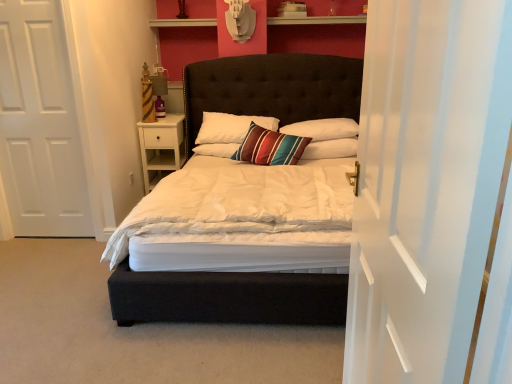
Where is `white soft pillow at center, which is counted as the third pillow, starting from the left`? This screenshot has height=384, width=512. white soft pillow at center, which is counted as the third pillow, starting from the left is located at coordinates (331, 149).

Locate an element on the screen. Image resolution: width=512 pixels, height=384 pixels. striped fabric pillow at center, which is the 3th pillow in right-to-left order is located at coordinates (270, 147).

Find the location of a particular element. white matte door at left is located at coordinates (40, 124).

Describe the element at coordinates (40, 124) in the screenshot. The width and height of the screenshot is (512, 384). I see `white matte door at left` at that location.

The height and width of the screenshot is (384, 512). In order to click on white soft pillow at center, acting as the 1th pillow starting from the right in this screenshot , I will do `click(331, 149)`.

Is white sheer curtain at right at the back of striped fabric pillow at center, the 2th pillow from the left?

No, white sheer curtain at right is not at the back of striped fabric pillow at center, the 2th pillow from the left.

Is striped fabric pillow at center, the 2th pillow from the left, positioned beyond the bounds of white sheer curtain at right?

Indeed, striped fabric pillow at center, the 2th pillow from the left, is completely outside white sheer curtain at right.

Which of these two, striped fabric pillow at center, the 2th pillow from the left, or white sheer curtain at right, is wider?

striped fabric pillow at center, the 2th pillow from the left, is wider.

Image resolution: width=512 pixels, height=384 pixels. What are the coordinates of `the 3rd pillow above when counting from the white sheer curtain at right (from the image's perspective)` in the screenshot? It's located at (323, 129).

In terms of width, does white soft pillow at center, which is counted as the third pillow, starting from the left, look wider or thinner when compared to white matte door at left?

white soft pillow at center, which is counted as the third pillow, starting from the left, is wider than white matte door at left.

Is white soft pillow at center, which is counted as the third pillow, starting from the left, outside of white matte door at left?

white soft pillow at center, which is counted as the third pillow, starting from the left, lies outside white matte door at left's area.

Is white soft pillow at center, acting as the 1th pillow starting from the right, shorter than white matte door at left?

Yes, white soft pillow at center, acting as the 1th pillow starting from the right, is shorter than white matte door at left.

Considering the relative sizes of white soft pillow at center, acting as the 1th pillow starting from the right, and white matte door at left in the image provided, is white soft pillow at center, acting as the 1th pillow starting from the right, bigger than white matte door at left?

Actually, white soft pillow at center, acting as the 1th pillow starting from the right, might be smaller than white matte door at left.

Which is closer to the camera, (256,124) or (1,134)?

Point (256,124).

Is white matte door at left surrounded by striped fabric pillow at center, which is the 3th pillow in right-to-left order?

That's incorrect, white matte door at left is not inside striped fabric pillow at center, which is the 3th pillow in right-to-left order.

From the image's perspective, which one is positioned lower, striped fabric pillow at center, the 1th pillow when ordered from left to right, or white matte door at left?

white matte door at left is shown below in the image.

Is white matte door at left at the back of striped fabric pillow at center, the 1th pillow when ordered from left to right?

No, white matte door at left is not at the back of striped fabric pillow at center, the 1th pillow when ordered from left to right.

Can you confirm if striped fabric pillow at center, the 1th pillow when ordered from left to right, is positioned to the right of striped fabric pillow at center, which is the 2th pillow in right-to-left order?

No.

I want to click on pillow on the left side of striped fabric pillow at center, the 2th pillow from the left, so click(270, 147).

How many degrees apart are the facing directions of striped fabric pillow at center, which is the 3th pillow in right-to-left order, and striped fabric pillow at center, which is the 2th pillow in right-to-left order?

7.18 degrees separate the facing orientations of striped fabric pillow at center, which is the 3th pillow in right-to-left order, and striped fabric pillow at center, which is the 2th pillow in right-to-left order.

Considering the sizes of objects striped fabric pillow at center, which is the 3th pillow in right-to-left order, and striped fabric pillow at center, the 2th pillow from the left, in the image provided, who is taller, striped fabric pillow at center, which is the 3th pillow in right-to-left order, or striped fabric pillow at center, the 2th pillow from the left,?

Standing taller between the two is striped fabric pillow at center, which is the 3th pillow in right-to-left order.

From a real-world perspective, which is physically below, white matte door at left or white soft pillow at center, which is counted as the third pillow, starting from the left?

white soft pillow at center, which is counted as the third pillow, starting from the left, is physically lower.

Is white matte door at left surrounding white soft pillow at center, acting as the 1th pillow starting from the right?

No, white matte door at left does not contain white soft pillow at center, acting as the 1th pillow starting from the right.

Which is behind, point (32, 62) or point (338, 142)?

Point (338, 142)

Is the position of white matte door at left less distant than that of white soft pillow at center, acting as the 1th pillow starting from the right?

Yes, white matte door at left is closer to the camera.

Is white wood nightstand at left outside of striped fabric pillow at center, the 1th pillow when ordered from left to right?

Indeed, white wood nightstand at left is completely outside striped fabric pillow at center, the 1th pillow when ordered from left to right.

Is white wood nightstand at left far away from striped fabric pillow at center, which is the 3th pillow in right-to-left order?

white wood nightstand at left is near striped fabric pillow at center, which is the 3th pillow in right-to-left order, not far away.

From the image's perspective, does white wood nightstand at left appear lower than striped fabric pillow at center, the 1th pillow when ordered from left to right?

Yes, from the image's perspective, white wood nightstand at left is below striped fabric pillow at center, the 1th pillow when ordered from left to right.

Would you consider white wood nightstand at left to be distant from striped fabric pillow at center, the 2th pillow from the left?

white wood nightstand at left is far away from striped fabric pillow at center, the 2th pillow from the left.

From the image's perspective, starting from the white wood nightstand at left, which pillow is the 3rd one above? Please provide its 2D coordinates.

[(323, 129)]

Is white wood nightstand at left situated inside striped fabric pillow at center, which is the 2th pillow in right-to-left order, or outside?

white wood nightstand at left lies outside striped fabric pillow at center, which is the 2th pillow in right-to-left order.

Could you tell me if white wood nightstand at left is facing striped fabric pillow at center, which is the 2th pillow in right-to-left order?

No, white wood nightstand at left is not aimed at striped fabric pillow at center, which is the 2th pillow in right-to-left order.

You are a GUI agent. You are given a task and a screenshot of the screen. Output one action in this format:
    pyautogui.click(x=<x>, y=<y>)
    Task: Click on the 3rd pillow behind the white sheer curtain at right
    
    Given the screenshot: What is the action you would take?
    pyautogui.click(x=323, y=129)

In order to click on door located in front of the white soft pillow at center, which is counted as the third pillow, starting from the left in this screenshot , I will do 40,124.

Consider the image. Considering their positions, is velvet dark brown bed at center positioned closer to white sheer curtain at right than striped fabric pillow at center, which is the 3th pillow in right-to-left order?

Among the two, striped fabric pillow at center, which is the 3th pillow in right-to-left order, is located nearer to white sheer curtain at right.

Estimate the real-world distances between objects in this image. Which object is closer to white wood nightstand at left, white soft pillow at center, which is counted as the third pillow, starting from the left, or striped fabric pillow at center, the 1th pillow when ordered from left to right?

striped fabric pillow at center, the 1th pillow when ordered from left to right.

Looking at the image, which one is located further to striped fabric pillow at center, the 2th pillow from the left, white wood nightstand at left or striped fabric pillow at center, the 1th pillow when ordered from left to right?

white wood nightstand at left lies further to striped fabric pillow at center, the 2th pillow from the left, than the other object.

From the image, which object appears to be farther from white matte door at left, white soft pillow at center, which is counted as the third pillow, starting from the left, or striped fabric pillow at center, the 1th pillow when ordered from left to right?

The object further to white matte door at left is white soft pillow at center, which is counted as the third pillow, starting from the left.

When comparing their distances from white soft pillow at center, which is counted as the third pillow, starting from the left, does white wood nightstand at left or striped fabric pillow at center, which is the 2th pillow in right-to-left order, seem further?

Based on the image, white wood nightstand at left appears to be further to white soft pillow at center, which is counted as the third pillow, starting from the left.

Based on their spatial positions, is white wood nightstand at left or white sheer curtain at right further from white soft pillow at center, acting as the 1th pillow starting from the right?

white sheer curtain at right.

Considering their positions, is white soft pillow at center, which is counted as the third pillow, starting from the left, positioned further to white matte door at left than striped fabric pillow at center, the 2th pillow from the left?

white soft pillow at center, which is counted as the third pillow, starting from the left, lies further to white matte door at left than the other object.

Which object lies nearer to the anchor point striped fabric pillow at center, which is the 2th pillow in right-to-left order, white matte door at left or velvet dark brown bed at center?

Among the two, velvet dark brown bed at center is located nearer to striped fabric pillow at center, which is the 2th pillow in right-to-left order.

Where is `bed between white matte door at left and white soft pillow at center, acting as the 1th pillow starting from the right, from left to right`? The height and width of the screenshot is (384, 512). bed between white matte door at left and white soft pillow at center, acting as the 1th pillow starting from the right, from left to right is located at coordinates (227, 299).

The height and width of the screenshot is (384, 512). I want to click on door between white sheer curtain at right and striped fabric pillow at center, which is the 2th pillow in right-to-left order, in the front-back direction, so click(40, 124).

Where is `pillow between white wood nightstand at left and striped fabric pillow at center, which is the 2th pillow in right-to-left order`? pillow between white wood nightstand at left and striped fabric pillow at center, which is the 2th pillow in right-to-left order is located at coordinates (270, 147).

I want to click on bed between white sheer curtain at right and white soft pillow at center, acting as the 1th pillow starting from the right, from front to back, so click(x=227, y=299).